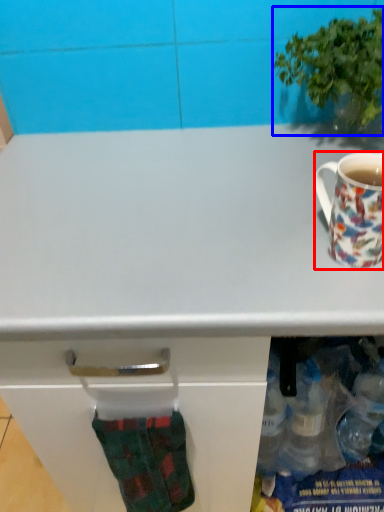
Question: Among these objects, which one is nearest to the camera, coffee cup (highlighted by a red box) or houseplant (highlighted by a blue box)?

Choices:
 (A) coffee cup
 (B) houseplant

Answer: (A)